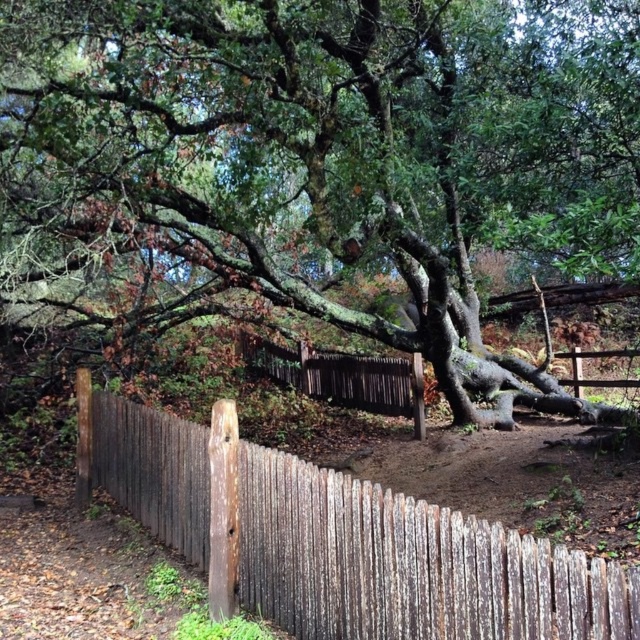
Which is below, green mossy tree at center or weathered wood fence at center?

Positioned lower is weathered wood fence at center.

Does green mossy tree at center have a greater height compared to weathered wood fence at center?

No.

Is point (144, 116) positioned behind point (481, 625)?

Yes, it is behind point (481, 625).

Locate an element on the screen. green mossy tree at center is located at coordinates (326, 156).